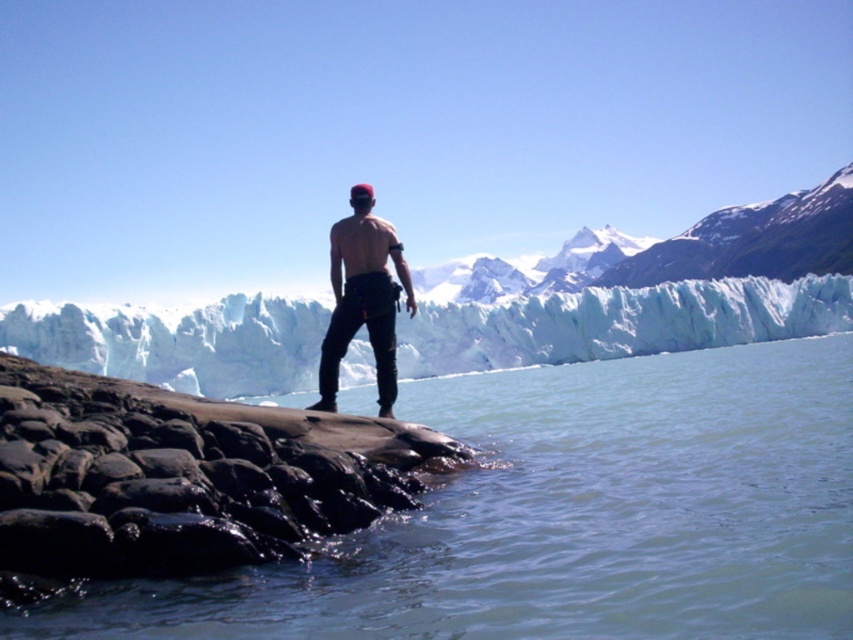
Can you confirm if white ice glacier at center is thinner than matte black pants at center?

No.

Who is taller, white ice glacier at center or matte black pants at center?

white ice glacier at center

This screenshot has width=853, height=640. In order to click on white ice glacier at center in this screenshot , I will do pyautogui.click(x=619, y=323).

Is clear water at lower center bigger than matte black pants at center?

Yes.

Which of these two, clear water at lower center or matte black pants at center, stands shorter?

clear water at lower center is shorter.

You are a GUI agent. You are given a task and a screenshot of the screen. Output one action in this format:
    pyautogui.click(x=<x>, y=<y>)
    Task: Click on the clear water at lower center
    Image resolution: width=853 pixels, height=640 pixels.
    Given the screenshot: What is the action you would take?
    pyautogui.click(x=567, y=516)

Between smooth dark rock at lower left and matte black pants at center, which one has less height?

smooth dark rock at lower left

This screenshot has width=853, height=640. In order to click on smooth dark rock at lower left in this screenshot , I will do `click(181, 477)`.

Image resolution: width=853 pixels, height=640 pixels. In order to click on smooth dark rock at lower left in this screenshot , I will do `click(181, 477)`.